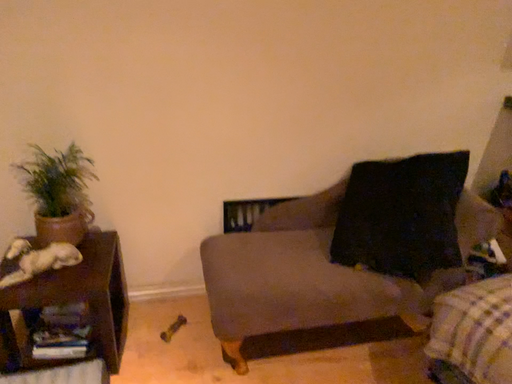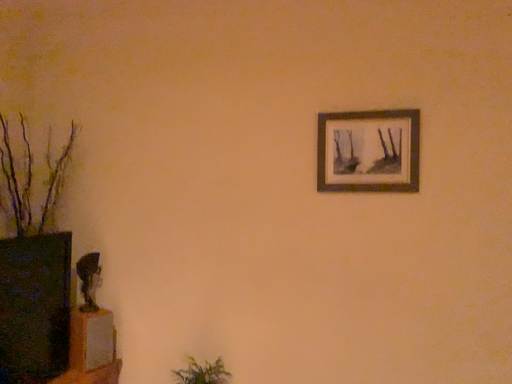
Question: Which way did the camera rotate in the video?

Choices:
 (A) rotated left
 (B) rotated right

Answer: (A)